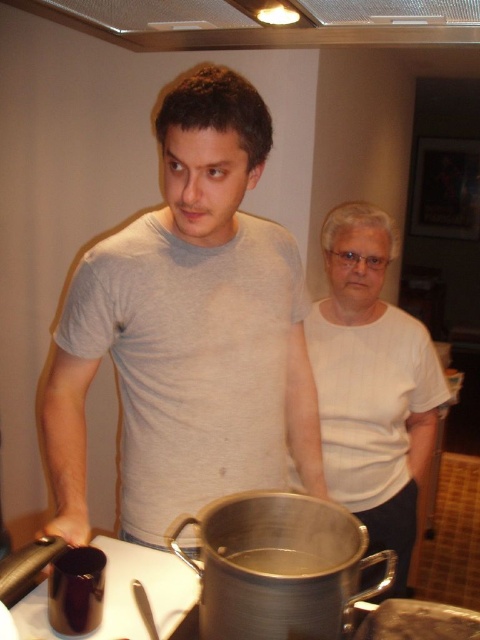
The image size is (480, 640). What do you see at coordinates (190, 320) in the screenshot?
I see `gray matte t-shirt at center` at bounding box center [190, 320].

Is point (253, 339) less distant than point (335, 492)?

Yes, point (253, 339) is in front of point (335, 492).

Locate an element on the screen. The height and width of the screenshot is (640, 480). gray matte t-shirt at center is located at coordinates (190, 320).

Does point (357, 356) come closer to viewer compared to point (232, 557)?

That is False.

Looking at this image, is the position of white matte shirt at center less distant than that of metallic silver pot at center?

No, white matte shirt at center is further to the viewer.

Is point (371, 294) positioned behind point (283, 566)?

Yes, it is.

You are a GUI agent. You are given a task and a screenshot of the screen. Output one action in this format:
    pyautogui.click(x=<x>, y=<y>)
    Task: Click on the white matte shirt at center
    This screenshot has width=480, height=640.
    Given the screenshot: What is the action you would take?
    pyautogui.click(x=372, y=384)

Who is shorter, gray matte t-shirt at center or metallic silver pot at center?

metallic silver pot at center

Is point (220, 429) positioned in front of point (314, 568)?

That is False.

Identify the location of gray matte t-shirt at center. (190, 320).